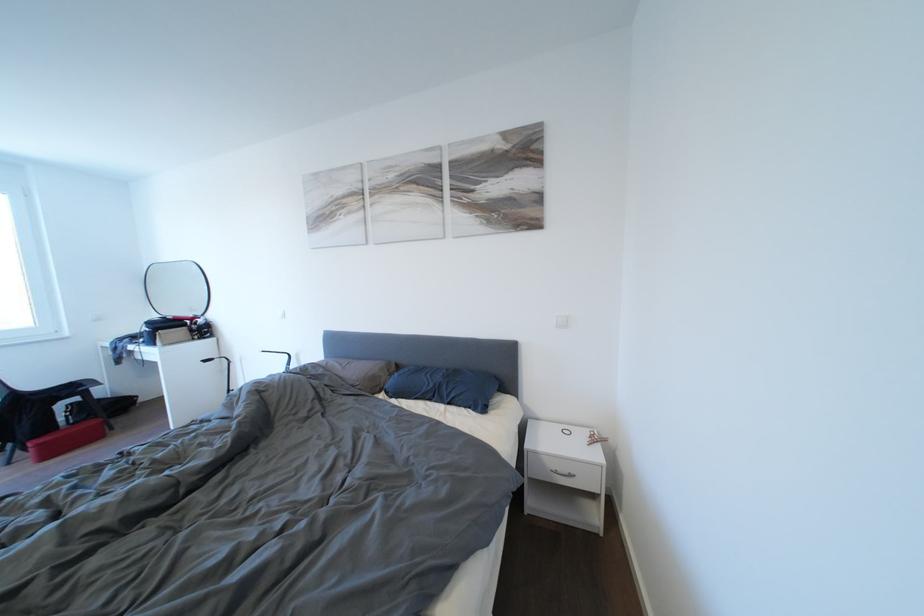
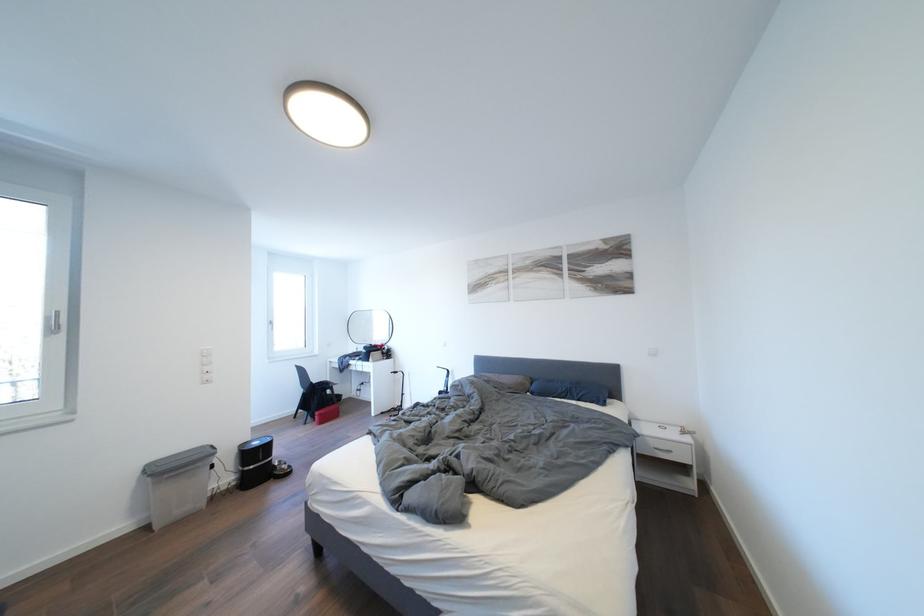
Question: I am providing you with two images of the same scene from different viewpoints. After the viewpoint changes to image2, which objects are now occluded?

Choices:
 (A) grey bin handle
 (B) white window handle
 (C) blue pillow
 (D) none of these

Answer: (D)